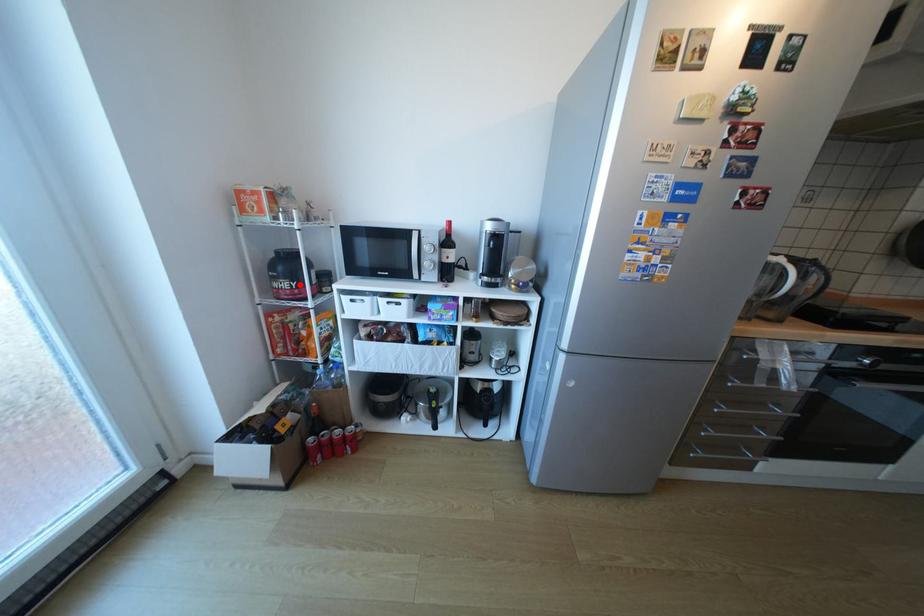
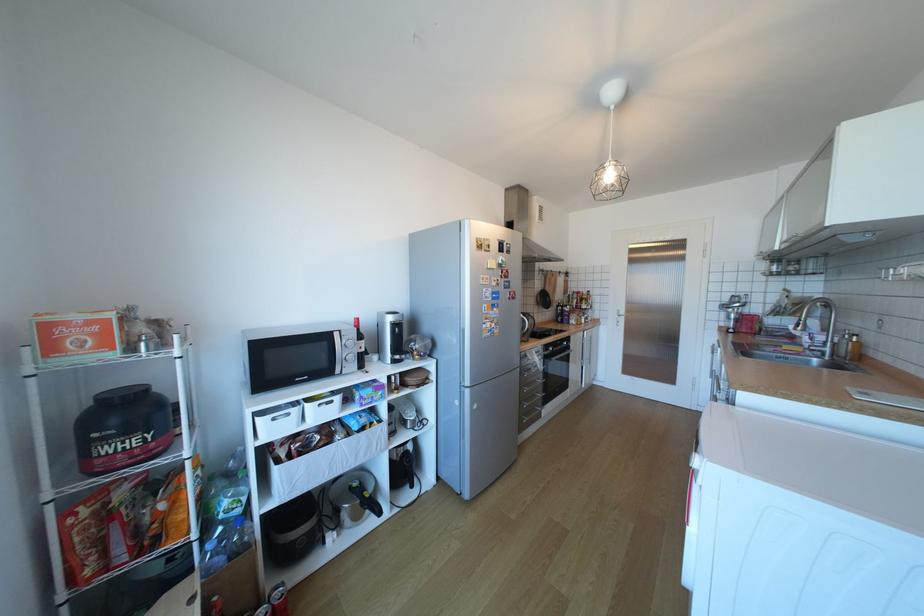
In the second image, find the point that corresponds to the highlighted location in the first image.

(152, 439)